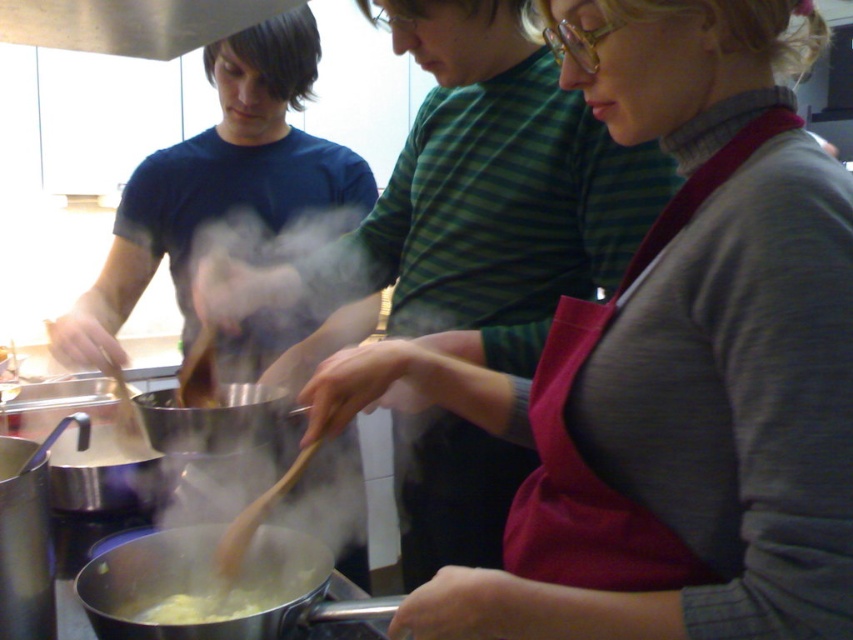
Based on the scene description, can you determine if the yellow creamy pasta at lower center is inside the stainless steel pot at lower center?

The stainless steel pot at lower center is above the yellow creamy pasta at lower center, so the pasta is likely inside the pot.

You are a guest in the kitchen and want to reach the yellow creamy pasta at lower center. There is a shiny silver pot at center in the way. Can you move the pot to get to the pasta?

The shiny silver pot at center is located above the yellow creamy pasta at lower center, so you cannot move the pot to access the pasta because it is already positioned above it.